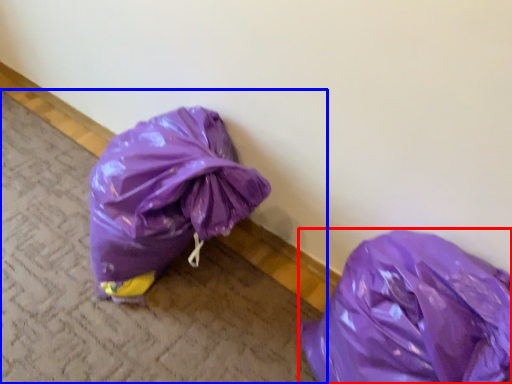
Question: Which of the following is the closest to the observer, plastic bag (highlighted by a red box) or pavement (highlighted by a blue box)?

Choices:
 (A) plastic bag
 (B) pavement

Answer: (A)